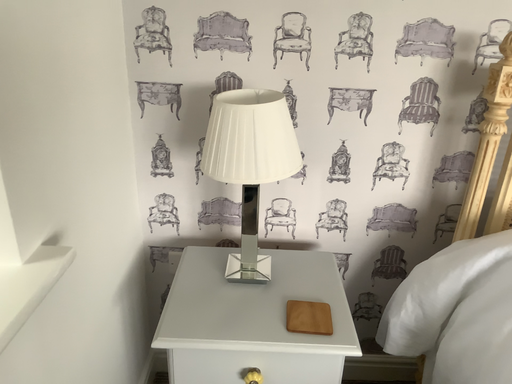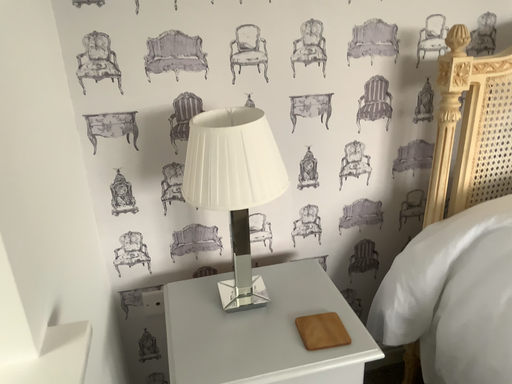
Question: Which way did the camera rotate in the video?

Choices:
 (A) rotated right
 (B) rotated left

Answer: (A)